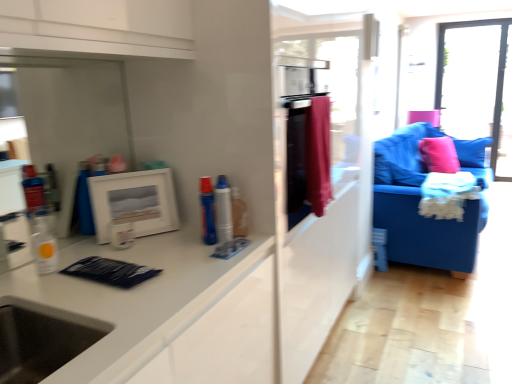
The image size is (512, 384). Describe the element at coordinates (473, 78) in the screenshot. I see `transparent glass window at upper right` at that location.

Find the location of `blue plastic toothpaste at center, which appears as the 2th toiletry when viewed from the right`. blue plastic toothpaste at center, which appears as the 2th toiletry when viewed from the right is located at coordinates (207, 211).

Image resolution: width=512 pixels, height=384 pixels. What do you see at coordinates (418, 207) in the screenshot?
I see `blue fabric couch at right` at bounding box center [418, 207].

The image size is (512, 384). Describe the element at coordinates (318, 154) in the screenshot. I see `velvet red curtain at center` at that location.

Measure the distance between point (436,161) and camera.

Point (436,161) and camera are 4.29 meters apart from each other.

What is the approximate height of black matte sink at lower left?

The height of black matte sink at lower left is 7.27 inches.

The height and width of the screenshot is (384, 512). In order to click on white matte picture frame at upper left in this screenshot , I will do `click(134, 202)`.

From a real-world perspective, between white matte picture frame at upper left and transparent glass window at upper right, who is vertically higher?

From a 3D spatial view, white matte picture frame at upper left is above.

In terms of width, does white matte picture frame at upper left look wider or thinner when compared to transparent glass window at upper right?

Clearly, white matte picture frame at upper left has less width compared to transparent glass window at upper right.

In the scene shown: Would you consider white matte picture frame at upper left to be distant from transparent glass window at upper right?

Yes, white matte picture frame at upper left and transparent glass window at upper right are quite far apart.

Is blue plastic toothpaste at center, which appears as the 2th toiletry when viewed from the right, further to camera compared to transparent glass window at upper right?

No, the depth of blue plastic toothpaste at center, which appears as the 2th toiletry when viewed from the right, is less than that of transparent glass window at upper right.

Could transparent glass window at upper right be considered to be inside blue plastic toothpaste at center, which appears as the 2th toiletry when viewed from the right?

No, blue plastic toothpaste at center, which appears as the 2th toiletry when viewed from the right, does not contain transparent glass window at upper right.

Considering the relative sizes of blue plastic toothpaste at center, the 2th toiletry when ordered from left to right, and transparent glass window at upper right in the image provided, is blue plastic toothpaste at center, the 2th toiletry when ordered from left to right, taller than transparent glass window at upper right?

No, blue plastic toothpaste at center, the 2th toiletry when ordered from left to right, is not taller than transparent glass window at upper right.

Considering the points (204, 205) and (461, 129), which point is in front, point (204, 205) or point (461, 129)?

The point (204, 205) is more forward.

Between blue plastic toothpaste at center, which appears as the 2th toiletry when viewed from the right, and pink fabric pillow at right, which one has less height?

With less height is blue plastic toothpaste at center, which appears as the 2th toiletry when viewed from the right.

Who is bigger, blue plastic toothpaste at center, the 2th toiletry when ordered from left to right, or pink fabric pillow at right?

pink fabric pillow at right is bigger.

Can you confirm if blue plastic toothpaste at center, the 2th toiletry when ordered from left to right, is positioned to the left of pink fabric pillow at right?

Yes, blue plastic toothpaste at center, the 2th toiletry when ordered from left to right, is to the left of pink fabric pillow at right.

Is there a large distance between blue plastic toothpaste at center, which appears as the 2th toiletry when viewed from the right, and pink fabric pillow at right?

blue plastic toothpaste at center, which appears as the 2th toiletry when viewed from the right, is far away from pink fabric pillow at right.

Which point is more forward, (44, 266) or (314, 110)?

Positioned in front is point (44, 266).

Is transparent plastic bottle at left, acting as the 1th toiletry starting from the left, facing away from velvet red curtain at center?

No, velvet red curtain at center is not at the back of transparent plastic bottle at left, acting as the 1th toiletry starting from the left.

Starting from the velvet red curtain at center, which toiletry is the 3rd one in front? Please provide its 2D coordinates.

[(44, 248)]

How many degrees apart are the facing directions of transparent plastic bottle at left, acting as the 1th toiletry starting from the left, and velvet red curtain at center?

The angle between the facing direction of transparent plastic bottle at left, acting as the 1th toiletry starting from the left, and the facing direction of velvet red curtain at center is 0.444 degrees.

Does black matte sink at lower left have a larger size compared to blue fabric couch at right?

No, black matte sink at lower left is not bigger than blue fabric couch at right.

Which is farther from the camera, (23, 355) or (401, 213)?

The point (401, 213) is farther from the camera.

Considering the relative sizes of black matte sink at lower left and blue fabric couch at right in the image provided, is black matte sink at lower left thinner than blue fabric couch at right?

Correct, the width of black matte sink at lower left is less than that of blue fabric couch at right.

Is black matte sink at lower left inside or outside of blue fabric couch at right?

black matte sink at lower left exists outside the volume of blue fabric couch at right.

From the image's perspective, is pink fabric pillow at right positioned above or below transparent plastic bottle at left, acting as the 1th toiletry starting from the left?

pink fabric pillow at right is situated higher than transparent plastic bottle at left, acting as the 1th toiletry starting from the left, in the image.

How many degrees apart are the facing directions of pink fabric pillow at right and transparent plastic bottle at left, acting as the 1th toiletry starting from the left?

pink fabric pillow at right and transparent plastic bottle at left, acting as the 1th toiletry starting from the left, are facing 29.4 degrees away from each other.

In the image, is pink fabric pillow at right positioned in front of or behind transparent plastic bottle at left, placed as the 3th toiletry when sorted from right to left?

In the image, pink fabric pillow at right appears behind transparent plastic bottle at left, placed as the 3th toiletry when sorted from right to left.

Considering the relative positions of pink fabric pillow at right and transparent plastic bottle at left, acting as the 1th toiletry starting from the left, in the image provided, is pink fabric pillow at right to the right of transparent plastic bottle at left, acting as the 1th toiletry starting from the left, from the viewer's perspective?

Yes, pink fabric pillow at right is to the right of transparent plastic bottle at left, acting as the 1th toiletry starting from the left.

Visually, is blue plastic toothpaste at center, the 2th toiletry when ordered from left to right, positioned to the left or to the right of blue plastic spray can at center, the third toiletry in the left-to-right sequence?

Clearly, blue plastic toothpaste at center, the 2th toiletry when ordered from left to right, is on the left of blue plastic spray can at center, the third toiletry in the left-to-right sequence, in the image.

Are blue plastic toothpaste at center, which appears as the 2th toiletry when viewed from the right, and blue plastic spray can at center, the third toiletry in the left-to-right sequence, located far from each other?

No.

Consider the image. Does blue plastic toothpaste at center, the 2th toiletry when ordered from left to right, come behind blue plastic spray can at center, the first toiletry from the right?

Yes, the depth of blue plastic toothpaste at center, the 2th toiletry when ordered from left to right, is greater than that of blue plastic spray can at center, the first toiletry from the right.

Can you confirm if blue plastic toothpaste at center, which appears as the 2th toiletry when viewed from the right, is taller than blue plastic spray can at center, the third toiletry in the left-to-right sequence?

No.

Where is `picture frame to the left of transparent glass window at upper right`? picture frame to the left of transparent glass window at upper right is located at coordinates (134, 202).

The image size is (512, 384). In order to click on the 1st toiletry in front of the transparent glass window at upper right in this screenshot , I will do `click(207, 211)`.

Based on their spatial positions, is pink fabric pillow at right or blue plastic spray can at center, the first toiletry from the right, closer to blue fabric couch at right?

pink fabric pillow at right is positioned closer to the anchor blue fabric couch at right.

Based on their spatial positions, is white matte picture frame at upper left or blue plastic toothpaste at center, which appears as the 2th toiletry when viewed from the right, further from velvet red curtain at center?

The object further to velvet red curtain at center is white matte picture frame at upper left.

Based on their spatial positions, is blue fabric couch at right or velvet red curtain at center further from transparent glass window at upper right?

Among the two, velvet red curtain at center is located further to transparent glass window at upper right.

From the picture: Which object lies nearer to the anchor point white matte picture frame at upper left, black matte sink at lower left or blue plastic toothpaste at center, the 2th toiletry when ordered from left to right?

blue plastic toothpaste at center, the 2th toiletry when ordered from left to right, is positioned closer to the anchor white matte picture frame at upper left.

Looking at the image, which one is located further to velvet red curtain at center, pink fabric pillow at right or blue plastic spray can at center, the third toiletry in the left-to-right sequence?

Based on the image, pink fabric pillow at right appears to be further to velvet red curtain at center.

Based on their spatial positions, is blue plastic toothpaste at center, the 2th toiletry when ordered from left to right, or transparent plastic bottle at left, placed as the 3th toiletry when sorted from right to left, further from white matte picture frame at upper left?

The object further to white matte picture frame at upper left is transparent plastic bottle at left, placed as the 3th toiletry when sorted from right to left.

Consider the image. Looking at the image, which one is located closer to transparent plastic bottle at left, placed as the 3th toiletry when sorted from right to left, pink fabric pillow at right or velvet red curtain at center?

velvet red curtain at center is positioned closer to the anchor transparent plastic bottle at left, placed as the 3th toiletry when sorted from right to left.

Consider the image. From the image, which object appears to be nearer to pink fabric pillow at right, velvet red curtain at center or transparent glass window at upper right?

The object closer to pink fabric pillow at right is transparent glass window at upper right.

At what (x,y) coordinates should I click in order to perform the action: click on picture frame between transparent plastic bottle at left, acting as the 1th toiletry starting from the left, and blue fabric couch at right from left to right. Please return your answer as a coordinate pair (x, y). Looking at the image, I should click on (134, 202).

At what (x,y) coordinates should I click in order to perform the action: click on picture frame between transparent plastic bottle at left, acting as the 1th toiletry starting from the left, and transparent glass window at upper right, along the z-axis. Please return your answer as a coordinate pair (x, y). The height and width of the screenshot is (384, 512). Looking at the image, I should click on click(134, 202).

The image size is (512, 384). I want to click on pillow between transparent plastic bottle at left, placed as the 3th toiletry when sorted from right to left, and transparent glass window at upper right from front to back, so click(x=439, y=155).

The height and width of the screenshot is (384, 512). I want to click on material between white matte picture frame at upper left and transparent glass window at upper right from front to back, so click(x=318, y=154).